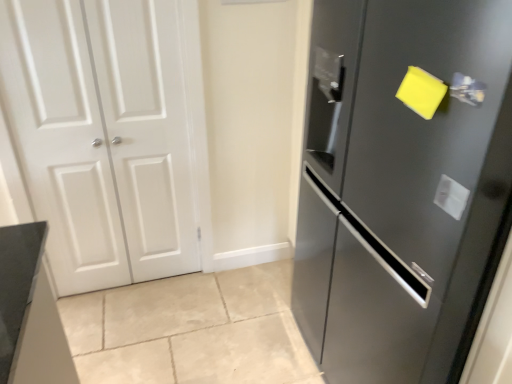
Image resolution: width=512 pixels, height=384 pixels. Identify the location of satin black refrigerator at right, which is counted as the 1th door, starting from the right. (399, 186).

How much space does satin black refrigerator at right, which ranks as the second door in left-to-right order, occupy vertically?

satin black refrigerator at right, which ranks as the second door in left-to-right order, is 1.51 meters in height.

The width and height of the screenshot is (512, 384). I want to click on satin silver handle at upper right, so click(x=467, y=89).

Where is `satin black refrigerator at right, which ranks as the second door in left-to-right order`? The height and width of the screenshot is (384, 512). satin black refrigerator at right, which ranks as the second door in left-to-right order is located at coordinates (399, 186).

From the picture: Which is more to the right, satin black refrigerator at right, which is counted as the 1th door, starting from the right, or satin silver handle at upper right?

From the viewer's perspective, satin black refrigerator at right, which is counted as the 1th door, starting from the right, appears more on the right side.

Who is smaller, satin black refrigerator at right, which ranks as the second door in left-to-right order, or satin silver handle at upper right?

satin silver handle at upper right is smaller.

Is satin black refrigerator at right, which ranks as the second door in left-to-right order, closer to camera compared to satin silver handle at upper right?

That is True.

From the image's perspective, is satin black refrigerator at right, which ranks as the second door in left-to-right order, below satin silver handle at upper right?

Yes, from the image's perspective, satin black refrigerator at right, which ranks as the second door in left-to-right order, is below satin silver handle at upper right.

Is satin black refrigerator at right, which ranks as the second door in left-to-right order, not near white matte door at left, the 1th door from the left?

Yes, satin black refrigerator at right, which ranks as the second door in left-to-right order, and white matte door at left, the 1th door from the left, are quite far apart.

Is satin black refrigerator at right, which is counted as the 1th door, starting from the right, closer to the viewer compared to white matte door at left, which is the second door in right-to-left order?

Yes, satin black refrigerator at right, which is counted as the 1th door, starting from the right, is closer to the viewer.

Is point (379, 208) positioned in front of point (170, 15)?

Yes, point (379, 208) is closer to viewer.

How much distance is there between satin black refrigerator at right, which ranks as the second door in left-to-right order, and white matte door at left, the 1th door from the left?

satin black refrigerator at right, which ranks as the second door in left-to-right order, and white matte door at left, the 1th door from the left, are 3.29 feet apart from each other.

You are a GUI agent. You are given a task and a screenshot of the screen. Output one action in this format:
    pyautogui.click(x=<x>, y=<y>)
    Task: Click on the door handle in front of the white matte door at left, which is the second door in right-to-left order
    The width and height of the screenshot is (512, 384).
    Given the screenshot: What is the action you would take?
    [x=467, y=89]

Is white matte door at left, which is the second door in right-to-left order, facing away from satin silver handle at upper right?

No, white matte door at left, which is the second door in right-to-left order,'s orientation is not away from satin silver handle at upper right.

Is white matte door at left, which is the second door in right-to-left order, directly adjacent to satin silver handle at upper right?

They are not placed beside each other.

Is white matte door at left, the 1th door from the left, at the right side of satin silver handle at upper right?

In fact, white matte door at left, the 1th door from the left, is to the left of satin silver handle at upper right.

Is satin silver handle at upper right facing away from satin black refrigerator at right, which ranks as the second door in left-to-right order?

Yes.

Considering the sizes of satin silver handle at upper right and satin black refrigerator at right, which is counted as the 1th door, starting from the right, in the image, is satin silver handle at upper right taller or shorter than satin black refrigerator at right, which is counted as the 1th door, starting from the right,?

Clearly, satin silver handle at upper right is shorter compared to satin black refrigerator at right, which is counted as the 1th door, starting from the right.

Choose the correct answer: Is satin silver handle at upper right inside satin black refrigerator at right, which ranks as the second door in left-to-right order, or outside it?

satin silver handle at upper right lies within the bounds of satin black refrigerator at right, which ranks as the second door in left-to-right order.

Which object is positioned more to the left, satin silver handle at upper right or satin black refrigerator at right, which ranks as the second door in left-to-right order?

satin silver handle at upper right is more to the left.

Are white matte door at left, which is the second door in right-to-left order, and satin black refrigerator at right, which ranks as the second door in left-to-right order, making contact?

No.

This screenshot has width=512, height=384. In order to click on door located above the white matte door at left, the 1th door from the left (from a real-world perspective) in this screenshot , I will do `click(399, 186)`.

Which is in front, point (58, 128) or point (371, 84)?

The point (371, 84) is closer.

Is white matte door at left, the 1th door from the left, positioned in front of satin black refrigerator at right, which ranks as the second door in left-to-right order?

That is False.

In the image, is satin silver handle at upper right positioned in front of or behind white matte door at left, which is the second door in right-to-left order?

Clearly, satin silver handle at upper right is in front of white matte door at left, which is the second door in right-to-left order.

Locate an element on the screen. The height and width of the screenshot is (384, 512). door that appears behind the satin silver handle at upper right is located at coordinates (110, 135).

From the image's perspective, which one is positioned lower, satin silver handle at upper right or white matte door at left, which is the second door in right-to-left order?

white matte door at left, which is the second door in right-to-left order, from the image's perspective.

Can you confirm if satin silver handle at upper right is wider than white matte door at left, the 1th door from the left?

Incorrect, the width of satin silver handle at upper right does not surpass that of white matte door at left, the 1th door from the left.

There is a satin silver handle at upper right. Identify the location of the 1st door below it (from a real-world perspective). (399, 186).

The image size is (512, 384). What are the coordinates of `door on the right of the white matte door at left, the 1th door from the left` in the screenshot? It's located at [x=399, y=186].

Looking at the image, which one is located further to satin black refrigerator at right, which ranks as the second door in left-to-right order, white matte door at left, which is the second door in right-to-left order, or satin silver handle at upper right?

white matte door at left, which is the second door in right-to-left order, is positioned further to the anchor satin black refrigerator at right, which ranks as the second door in left-to-right order.

From the image, which object appears to be farther from white matte door at left, which is the second door in right-to-left order, satin black refrigerator at right, which is counted as the 1th door, starting from the right, or satin silver handle at upper right?

satin silver handle at upper right lies further to white matte door at left, which is the second door in right-to-left order, than the other object.

Looking at the image, which one is located closer to satin silver handle at upper right, satin black refrigerator at right, which ranks as the second door in left-to-right order, or white matte door at left, the 1th door from the left?

The object closer to satin silver handle at upper right is satin black refrigerator at right, which ranks as the second door in left-to-right order.

When comparing their distances from white matte door at left, the 1th door from the left, does satin silver handle at upper right or satin black refrigerator at right, which is counted as the 1th door, starting from the right, seem closer?

satin black refrigerator at right, which is counted as the 1th door, starting from the right, lies closer to white matte door at left, the 1th door from the left, than the other object.

Which object lies further to the anchor point satin silver handle at upper right, white matte door at left, the 1th door from the left, or satin black refrigerator at right, which ranks as the second door in left-to-right order?

white matte door at left, the 1th door from the left, lies further to satin silver handle at upper right than the other object.

Based on their spatial positions, is satin silver handle at upper right or white matte door at left, the 1th door from the left, closer to satin black refrigerator at right, which ranks as the second door in left-to-right order?

The object closer to satin black refrigerator at right, which ranks as the second door in left-to-right order, is satin silver handle at upper right.

Locate an element on the screen. This screenshot has width=512, height=384. door handle located between white matte door at left, which is the second door in right-to-left order, and satin black refrigerator at right, which ranks as the second door in left-to-right order, in the left-right direction is located at coordinates (467, 89).